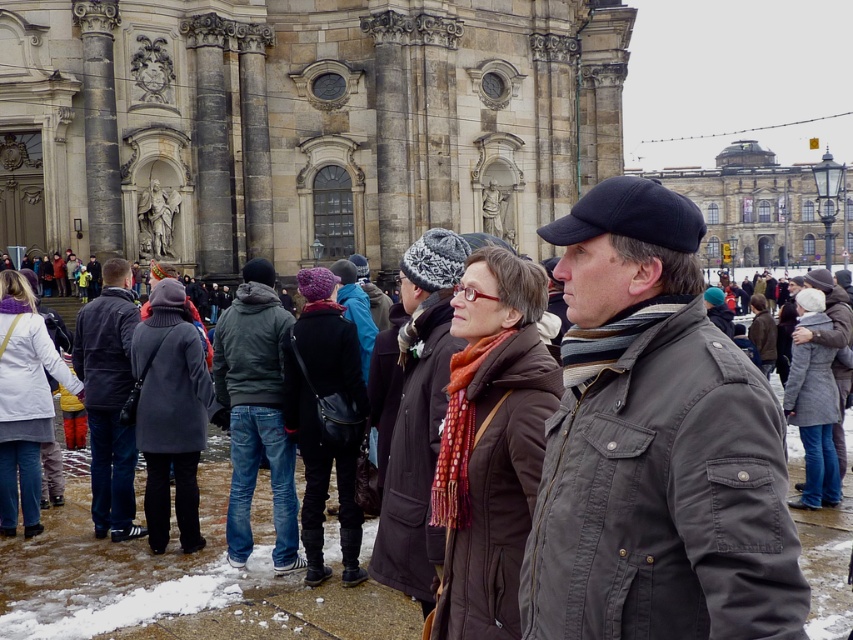
You are standing in front of the historic building and want to take a photo of the dark gray jacket at center without including the group of people. Is the jacket positioned in an area where you can frame it without the people?

The dark gray jacket at center is located at point (256, 412), which might be surrounded by the group of people. Since the jacket is at the center of the scene, it is likely positioned among the group, making it difficult to frame without including them.

You are a photographer standing in front of the historic building. You want to take a photo that includes both the dark gray jacket at center and the brown leather coat at center. Based on their positions, which one is closer to the ground?

The dark gray jacket at center is below the brown leather coat at center, so it is closer to the ground.

You are standing at point point (241, 301) and want to take a photo of the historic building. If your camera has a maximum zoom range of 200 feet, can you capture the entire building in your photo?

The distance between point (241, 301) and the camera is 179.47 feet, which is within the camera maximum zoom range of 200 feet. So yes, you can capture the entire building in your photo.